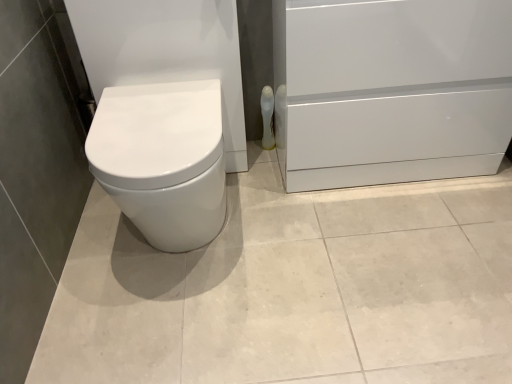
Question: Considering the relative positions of white glossy toilet paper at center-right and white glossy file cabinet at lower right in the image provided, is white glossy toilet paper at center-right to the left or to the right of white glossy file cabinet at lower right?

Choices:
 (A) left
 (B) right

Answer: (A)

Question: Is white glossy toilet paper at center-right wider or thinner than white glossy file cabinet at lower right?

Choices:
 (A) thin
 (B) wide

Answer: (A)

Question: Is white glossy toilet paper at center-right bigger or smaller than white glossy file cabinet at lower right?

Choices:
 (A) big
 (B) small

Answer: (B)

Question: Is point tap(309, 18) closer or farther from the camera than point tap(263, 139)?

Choices:
 (A) farther
 (B) closer

Answer: (B)

Question: Which is correct: white glossy file cabinet at lower right is inside white glossy toilet paper at center-right, or outside of it?

Choices:
 (A) inside
 (B) outside

Answer: (B)

Question: Is white glossy file cabinet at lower right taller or shorter than white glossy toilet paper at center-right?

Choices:
 (A) short
 (B) tall

Answer: (B)

Question: Visually, is white glossy file cabinet at lower right positioned to the left or to the right of white glossy toilet paper at center-right?

Choices:
 (A) right
 (B) left

Answer: (A)